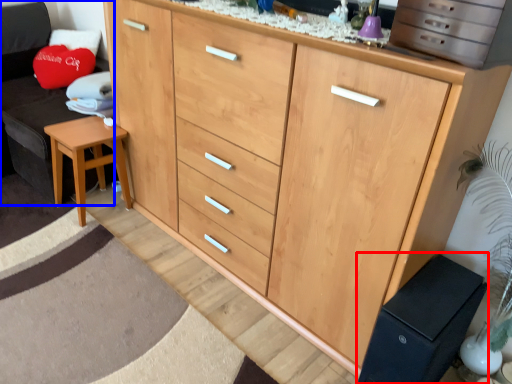
Question: Which object is closer to the camera taking this photo, changing table (highlighted by a red box) or swivel chair (highlighted by a blue box)?

Choices:
 (A) changing table
 (B) swivel chair

Answer: (A)